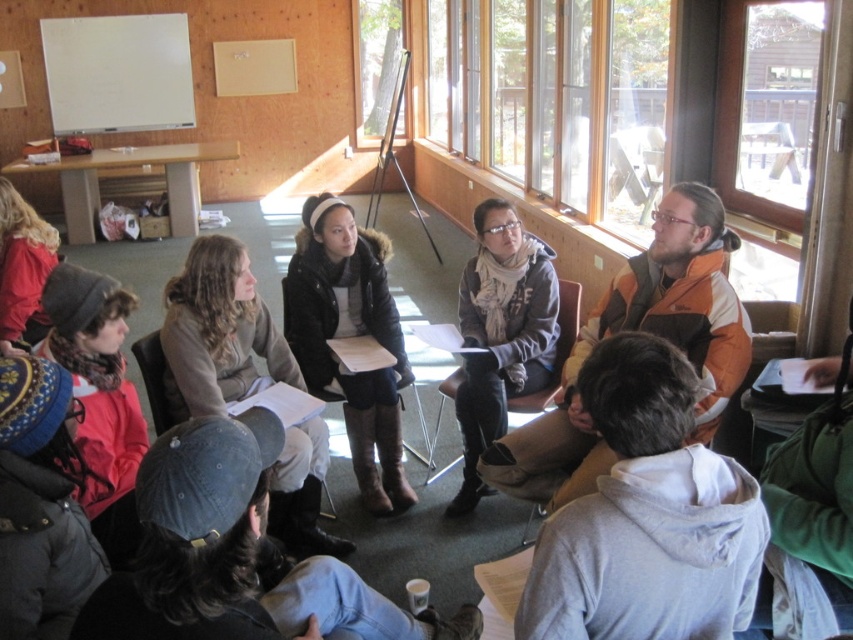
Between point (167, 362) and point (302, 243), which one is positioned behind?

Positioned behind is point (302, 243).

Locate an element on the screen. brown leather jacket at center is located at coordinates (218, 332).

Is orange and brown jacket at upper right further to camera compared to brown leather jacket at center?

No, it is in front of brown leather jacket at center.

I want to click on orange and brown jacket at upper right, so click(x=639, y=330).

Is point (608, 454) less distant than point (172, 298)?

That is True.

Find the location of `orange and brown jacket at upper right`. orange and brown jacket at upper right is located at coordinates pyautogui.click(x=639, y=330).

Who is positioned more to the right, orange and brown jacket at upper right or gray wool scarf at center?

orange and brown jacket at upper right

Between point (683, 321) and point (486, 372), which one is positioned behind?

The point (486, 372) is more distant.

At what (x,y) coordinates should I click in order to perform the action: click on orange and brown jacket at upper right. Please return your answer as a coordinate pair (x, y). The image size is (853, 640). Looking at the image, I should click on (639, 330).